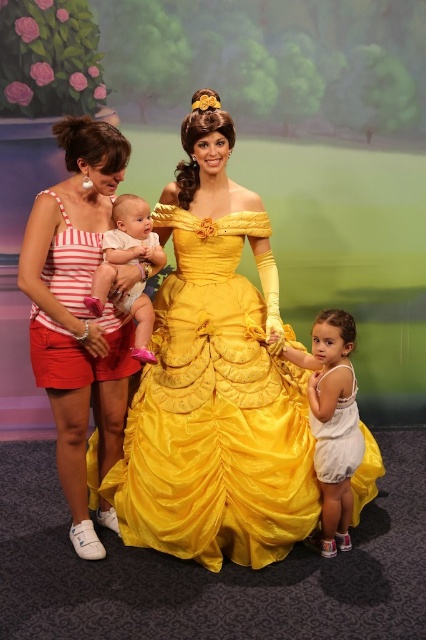
Does matte yellow dress at center have a larger size compared to white cotton onesie at center?

Yes.

Between matte yellow dress at center and white cotton onesie at center, which one appears on the left side from the viewer's perspective?

From the viewer's perspective, white cotton onesie at center appears more on the left side.

What do you see at coordinates (215, 381) in the screenshot? I see `matte yellow dress at center` at bounding box center [215, 381].

This screenshot has height=640, width=426. I want to click on matte yellow dress at center, so click(215, 381).

Does striped cotton tank top at left appear on the left side of white cotton onesie at center?

Indeed, striped cotton tank top at left is positioned on the left side of white cotton onesie at center.

Can you confirm if striped cotton tank top at left is wider than white cotton onesie at center?

Yes, striped cotton tank top at left is wider than white cotton onesie at center.

Between point (81, 161) and point (138, 253), which one is positioned in front?

Point (81, 161) is in front.

Locate an element on the screen. Image resolution: width=426 pixels, height=640 pixels. striped cotton tank top at left is located at coordinates (77, 312).

Which is more to the right, striped cotton tank top at left or white cotton dress at lower right?

Positioned to the right is white cotton dress at lower right.

Is striped cotton tank top at left further to the viewer compared to white cotton dress at lower right?

No, it is not.

Describe the element at coordinates (77, 312) in the screenshot. The width and height of the screenshot is (426, 640). I see `striped cotton tank top at left` at that location.

You are a GUI agent. You are given a task and a screenshot of the screen. Output one action in this format:
    pyautogui.click(x=<x>, y=<y>)
    Task: Click on the striped cotton tank top at left
    This screenshot has height=640, width=426.
    Given the screenshot: What is the action you would take?
    (77, 312)